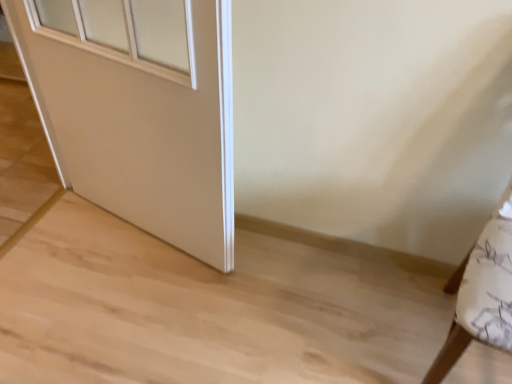
Find the location of a particular element. This screenshot has height=384, width=512. vacant area that lies between white fabric cushion at right and white matte door at center is located at coordinates (317, 309).